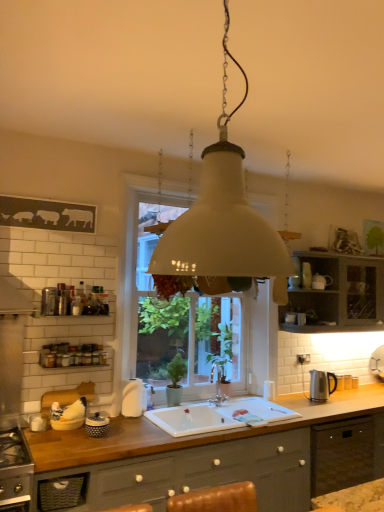
Identify the location of free space between white matte soap dispenser at center, which appears as the 2th appliance when viewed from the back, and polka dot ceramic jar at lower left, the first appliance viewed from the left. The image size is (384, 512). (123, 423).